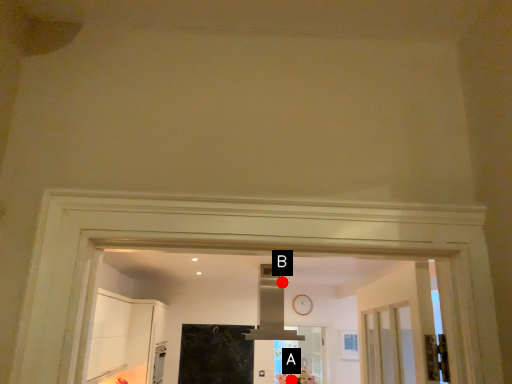
Question: Two points are circled on the image, labeled by A and B beside each circle. Which point is closer to the camera?

Choices:
 (A) A is closer
 (B) B is closer

Answer: (A)